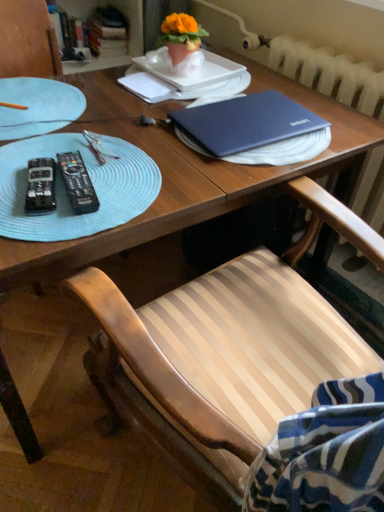
Where is `free space that is in between matte blue laptop at center and black plastic remote control at left, the first remote control viewed from the right`? free space that is in between matte blue laptop at center and black plastic remote control at left, the first remote control viewed from the right is located at coordinates (153, 164).